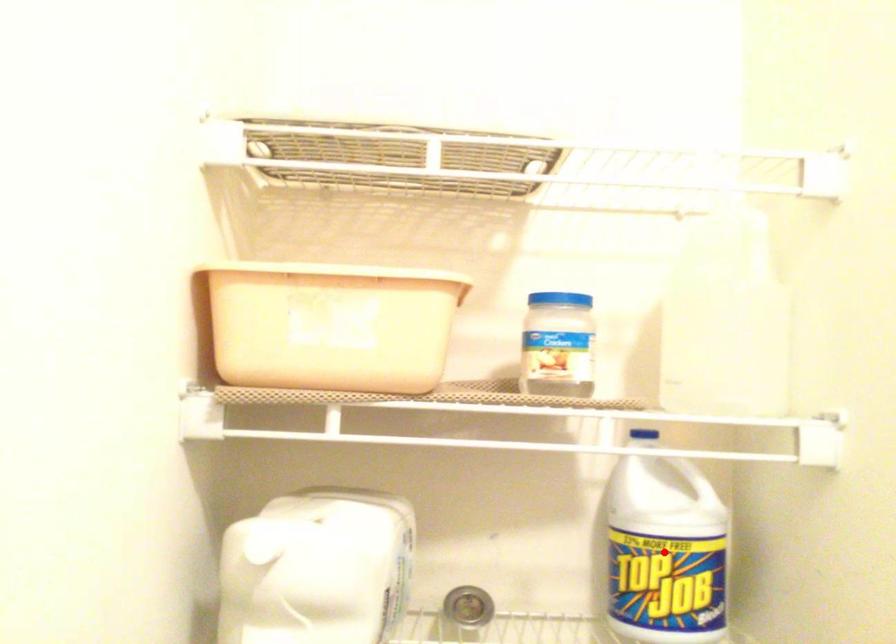
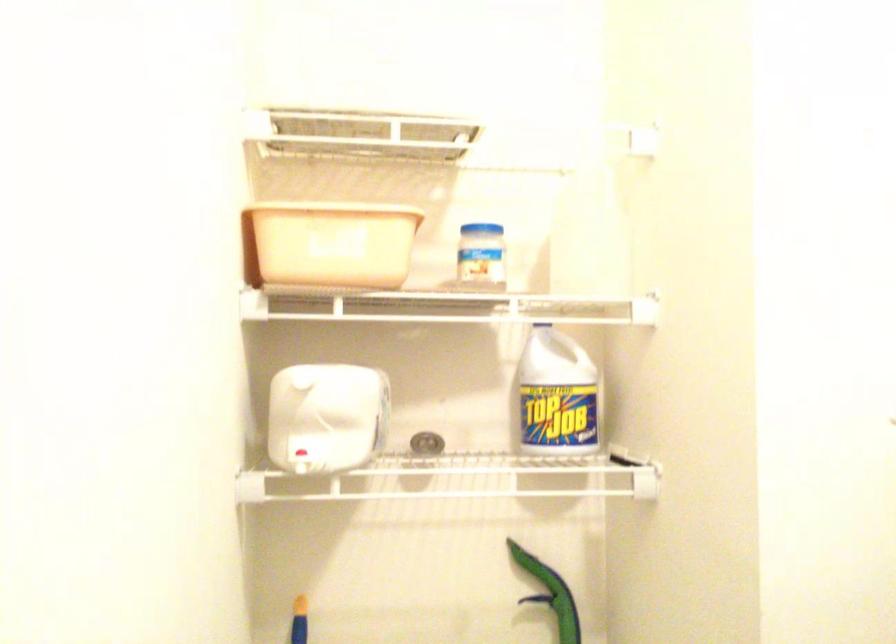
Question: I am providing you with two images of the same scene from different viewpoints. A red point is shown in image1. For the corresponding object point in image2, is it positioned nearer or farther from the camera?

Choices:
 (A) Nearer
 (B) Farther

Answer: (B)